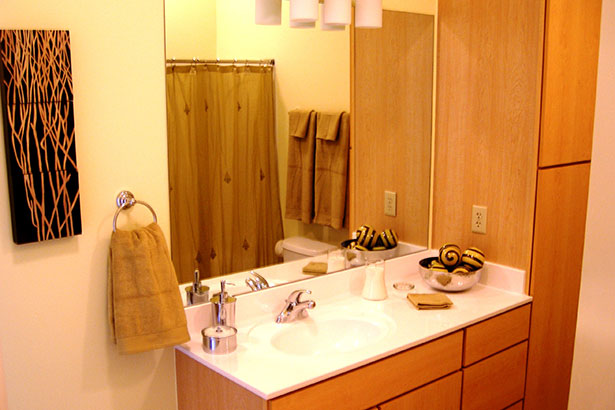
You are a GUI agent. You are given a task and a screenshot of the screen. Output one action in this format:
    pyautogui.click(x=<x>, y=<y>)
    Task: Click on the countertop
    Image resolution: width=615 pixels, height=410 pixels.
    Given the screenshot: What is the action you would take?
    [x=493, y=298], [x=411, y=326], [x=258, y=379]